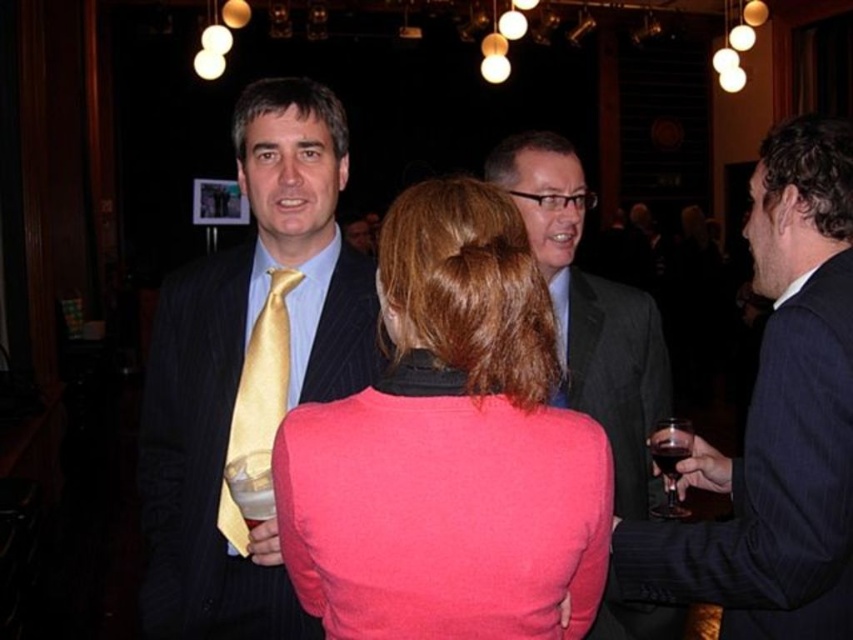
Question: Is pinstriped suit at center wider than matte black suit at right?

Choices:
 (A) no
 (B) yes

Answer: (B)

Question: Is pinstriped suit at center wider than matte black suit at right?

Choices:
 (A) yes
 (B) no

Answer: (A)

Question: Is matte pink sweater at center below gold satin tie at center?

Choices:
 (A) yes
 (B) no

Answer: (B)

Question: Which of the following is the farthest from the observer?

Choices:
 (A) matte black suit at right
 (B) matte black suit at center

Answer: (A)

Question: Which point is closer to the camera?

Choices:
 (A) (265, 365)
 (B) (849, 355)
 (C) (318, 452)

Answer: (C)

Question: Among these objects, which one is nearest to the camera?

Choices:
 (A) pinstriped suit at center
 (B) matte pink sweater at center
 (C) matte black suit at right

Answer: (B)